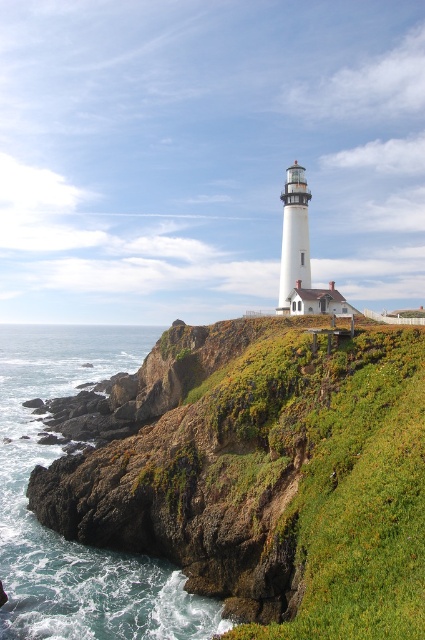
Question: From the image, what is the correct spatial relationship of green grassy hillside at center in relation to blue-green water at lower left?

Choices:
 (A) below
 (B) above

Answer: (B)

Question: Which point is closer to the camera?

Choices:
 (A) green grassy hillside at center
 (B) blue-green water at lower left

Answer: (A)

Question: In this image, where is green grassy hillside at center located relative to blue-green water at lower left?

Choices:
 (A) above
 (B) below

Answer: (A)

Question: Which object is farther from the camera taking this photo?

Choices:
 (A) blue-green water at lower left
 (B) green grassy hillside at center

Answer: (A)

Question: Is green grassy hillside at center below blue-green water at lower left?

Choices:
 (A) yes
 (B) no

Answer: (B)